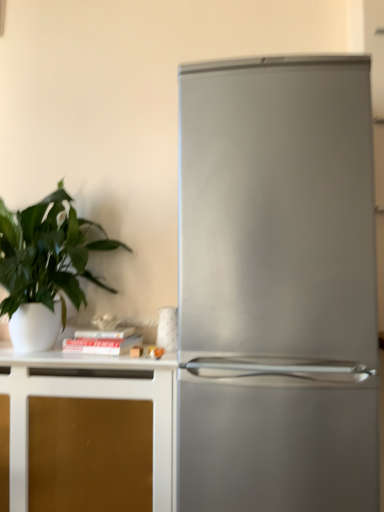
Question: Would you say gold matte cabinet at lower left is part of stainless steel refrigerator at right's contents?

Choices:
 (A) no
 (B) yes

Answer: (A)

Question: Does stainless steel refrigerator at right have a greater width compared to gold matte cabinet at lower left?

Choices:
 (A) yes
 (B) no

Answer: (A)

Question: Is stainless steel refrigerator at right oriented away from gold matte cabinet at lower left?

Choices:
 (A) no
 (B) yes

Answer: (A)

Question: Does stainless steel refrigerator at right come behind gold matte cabinet at lower left?

Choices:
 (A) yes
 (B) no

Answer: (B)

Question: From the image's perspective, is stainless steel refrigerator at right located beneath gold matte cabinet at lower left?

Choices:
 (A) yes
 (B) no

Answer: (B)

Question: Does stainless steel refrigerator at right have a lesser height compared to gold matte cabinet at lower left?

Choices:
 (A) no
 (B) yes

Answer: (A)

Question: Considering the relative positions of green matte plant at left and stainless steel refrigerator at right in the image provided, is green matte plant at left in front of stainless steel refrigerator at right?

Choices:
 (A) yes
 (B) no

Answer: (B)

Question: Considering the relative sizes of green matte plant at left and stainless steel refrigerator at right in the image provided, is green matte plant at left thinner than stainless steel refrigerator at right?

Choices:
 (A) no
 (B) yes

Answer: (B)

Question: Does green matte plant at left come behind stainless steel refrigerator at right?

Choices:
 (A) no
 (B) yes

Answer: (B)

Question: From a real-world perspective, is green matte plant at left physically below stainless steel refrigerator at right?

Choices:
 (A) yes
 (B) no

Answer: (B)

Question: Can you confirm if green matte plant at left is smaller than stainless steel refrigerator at right?

Choices:
 (A) no
 (B) yes

Answer: (B)

Question: Is green matte plant at left at the left side of stainless steel refrigerator at right?

Choices:
 (A) no
 (B) yes

Answer: (B)

Question: From the image's perspective, would you say stainless steel refrigerator at right is shown under green matte plant at left?

Choices:
 (A) yes
 (B) no

Answer: (A)